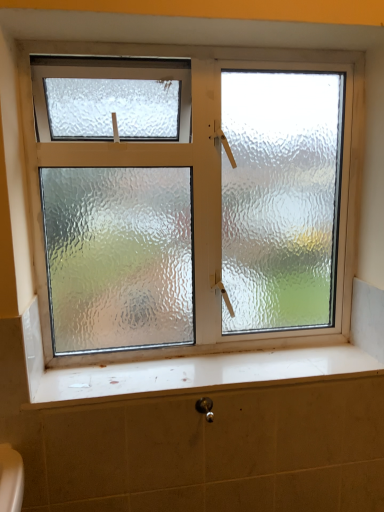
Locate an element on the screen. empty space that is ontop of white glossy window sill at lower center (from a real-world perspective) is located at coordinates (213, 366).